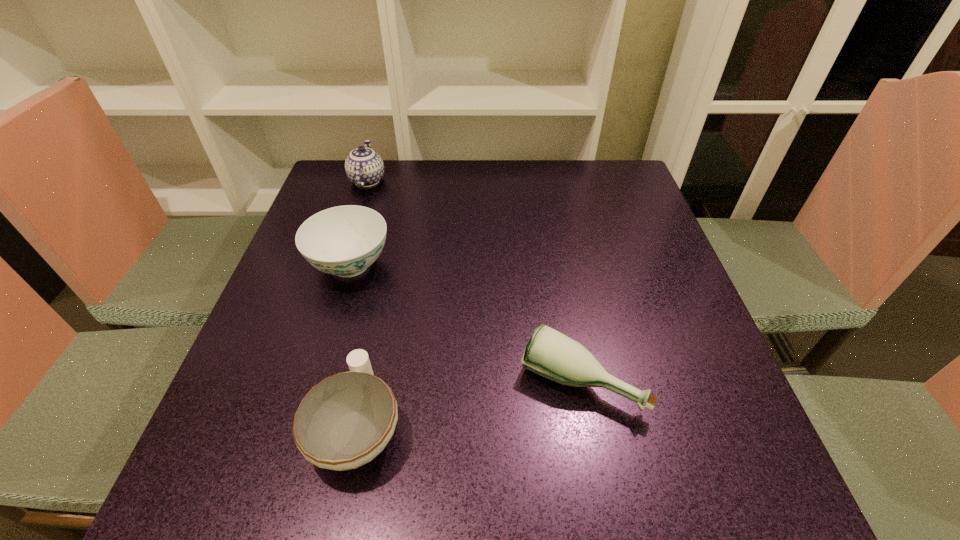
This screenshot has height=540, width=960. Find the location of `object situated at the near edge`. object situated at the near edge is located at coordinates (345, 421).

Find the location of a particular element. object that is at the right edge is located at coordinates (549, 353).

This screenshot has width=960, height=540. What are the coordinates of `object at the far left corner` in the screenshot? It's located at (364, 167).

I want to click on object that is at the near left corner, so click(x=345, y=421).

The height and width of the screenshot is (540, 960). What are the coordinates of `free space at the far edge of the desktop` in the screenshot? It's located at (573, 174).

What are the coordinates of `vacant area at the near edge` in the screenshot? It's located at (357, 469).

Where is `vacant region at the left edge of the desktop`? vacant region at the left edge of the desktop is located at coordinates (231, 416).

The image size is (960, 540). In the image, there is a desktop. In order to click on vacant region at the right edge in this screenshot , I will do `click(649, 218)`.

At what (x,y) coordinates should I click in order to perform the action: click on vacant point at the far left corner. Please return your answer as a coordinate pair (x, y). Image resolution: width=960 pixels, height=540 pixels. Looking at the image, I should click on (322, 193).

You are a GUI agent. You are given a task and a screenshot of the screen. Output one action in this format:
    pyautogui.click(x=<x>, y=<y>)
    Task: Click on the free space at the near right corner of the desktop
    
    Given the screenshot: What is the action you would take?
    pyautogui.click(x=680, y=490)